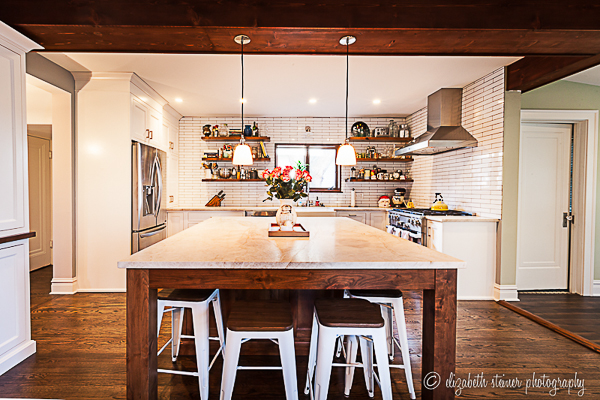
Find the location of `appliance handle`. appliance handle is located at coordinates (414, 237), (158, 174), (160, 167), (155, 231).